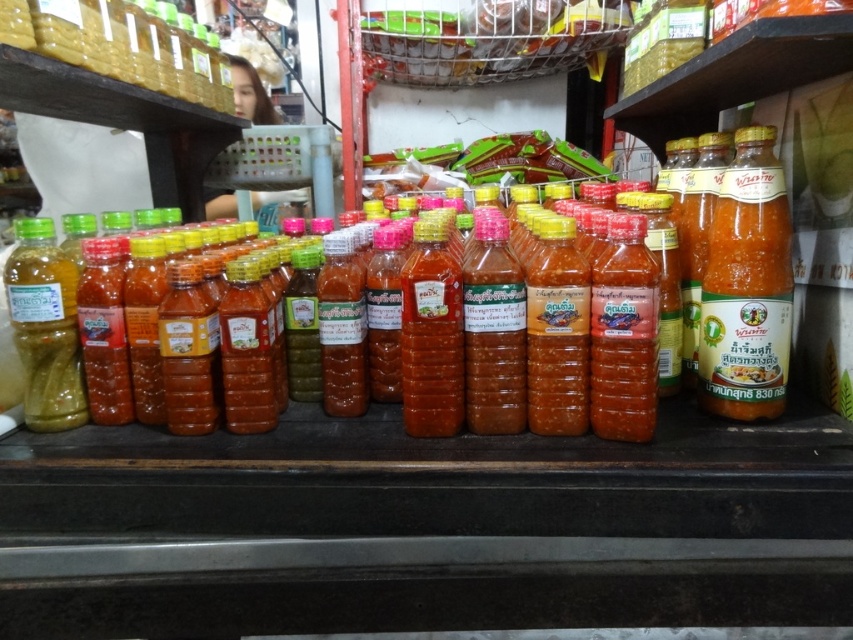
Does translucent orange sauce at center lie behind green matte bottle at left?

Yes, translucent orange sauce at center is behind green matte bottle at left.

Who is lower down, translucent orange sauce at center or green matte bottle at left?

green matte bottle at left is below.

Locate an element on the screen. The width and height of the screenshot is (853, 640). translucent orange sauce at center is located at coordinates coord(747,285).